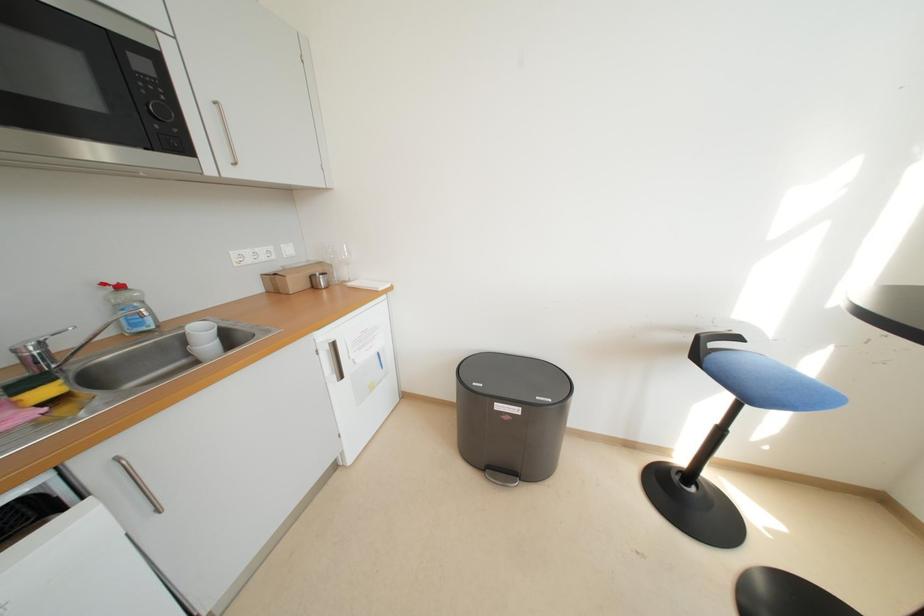
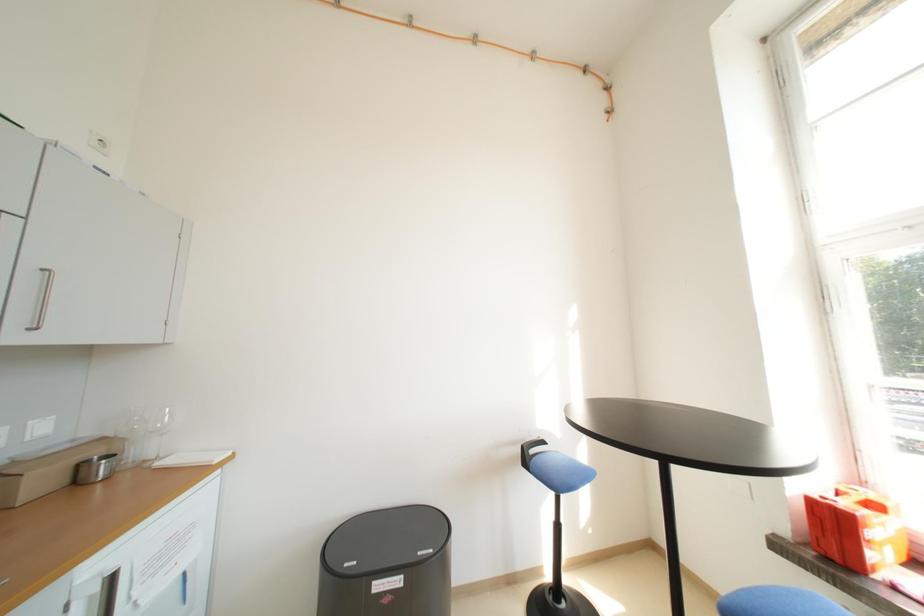
Based on the photo, based on the continuous images, in which direction is the camera rotating?

The rotation direction of the camera is right-up.